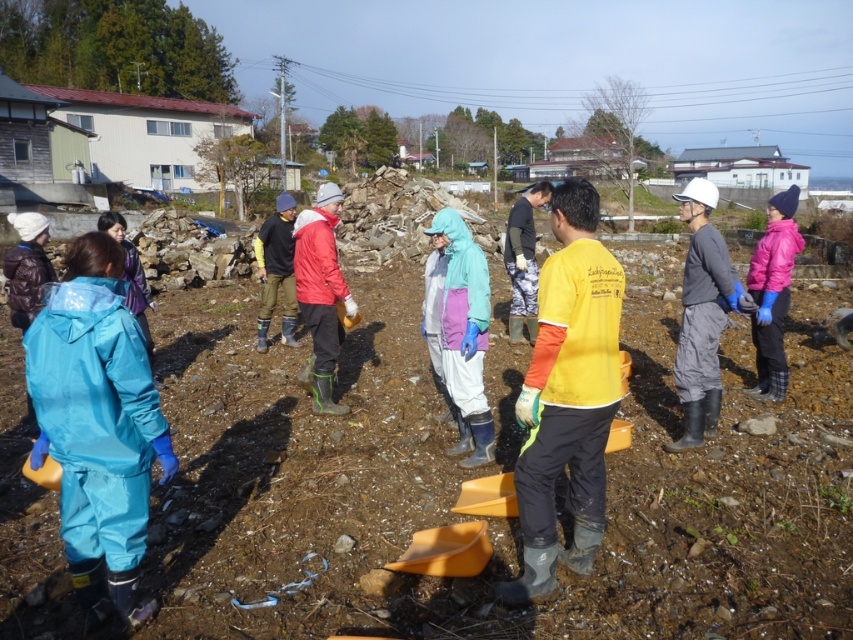
Question: Can you confirm if light blue waterproof jacket at center is thinner than matte red jacket at center?

Choices:
 (A) yes
 (B) no

Answer: (B)

Question: Estimate the real-world distances between objects in this image. Which object is farther from the gray matte pants at center?

Choices:
 (A) matte black jacket at center
 (B) blue waterproof suit at left

Answer: (A)

Question: Which is farther from the blue waterproof suit at left?

Choices:
 (A) matte red jacket at center
 (B) matte black jacket at center
 (C) gray matte pants at center
 (D) light blue waterproof jacket at center

Answer: (B)

Question: Can you confirm if blue waterproof suit at left is positioned to the right of matte black jacket at center?

Choices:
 (A) yes
 (B) no

Answer: (A)

Question: Does brown soil at center appear under matte red jacket at center?

Choices:
 (A) no
 (B) yes

Answer: (B)

Question: Which point appears closest to the camera in this image?

Choices:
 (A) (264, 300)
 (B) (138, 404)
 (C) (601, 580)
 (D) (706, 356)

Answer: (B)